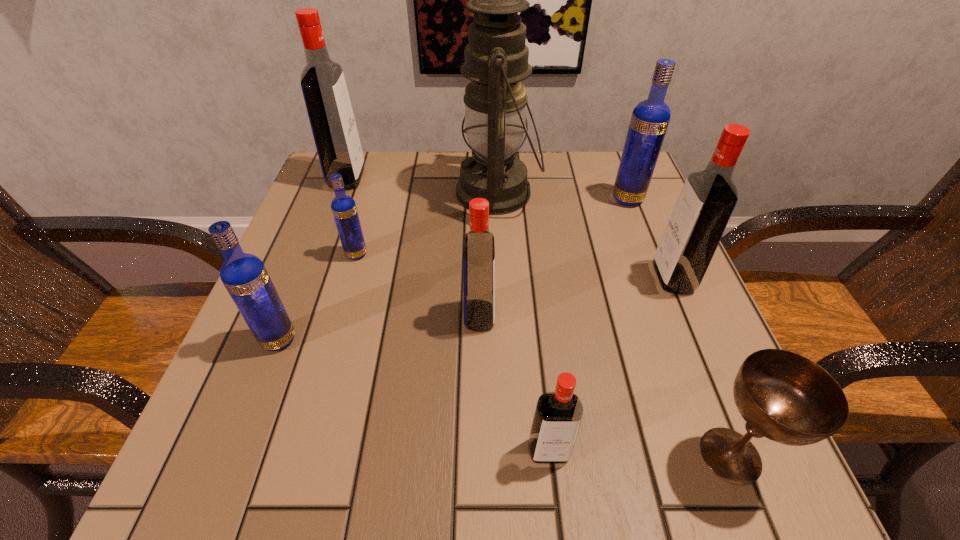
Find the location of a particular element. The image size is (960, 540). vacant space that's between the oil lamp and the leftmost blue vodka is located at coordinates (388, 266).

Locate an element on the screen. This screenshot has width=960, height=540. free space that is in between the smallest red vodka and the third smallest red vodka is located at coordinates (611, 364).

I want to click on free spot between the biggest red vodka and the third vodka from right to left, so click(x=448, y=315).

You are a GUI agent. You are given a task and a screenshot of the screen. Output one action in this format:
    pyautogui.click(x=<x>, y=<y>)
    Task: Click on the free space between the chalice and the oil lamp
    
    Given the screenshot: What is the action you would take?
    pyautogui.click(x=614, y=323)

Image resolution: width=960 pixels, height=540 pixels. I want to click on unoccupied area between the third object from left to right and the chalice, so click(x=543, y=355).

The width and height of the screenshot is (960, 540). What are the coordinates of `unoccupied area between the second biggest red vodka and the nearest red vodka` in the screenshot? It's located at (611, 364).

Find the location of a particular element. The image size is (960, 540). free area in between the leftmost blue vodka and the tallest vodka is located at coordinates (313, 259).

Where is `vacant area that lies between the oil lamp and the farthest red vodka`? vacant area that lies between the oil lamp and the farthest red vodka is located at coordinates (422, 185).

Locate an element on the screen. This screenshot has height=540, width=960. empty space that is in between the oil lamp and the tallest vodka is located at coordinates (422, 185).

I want to click on object that can be found as the closest to the rightmost red vodka, so click(650, 118).